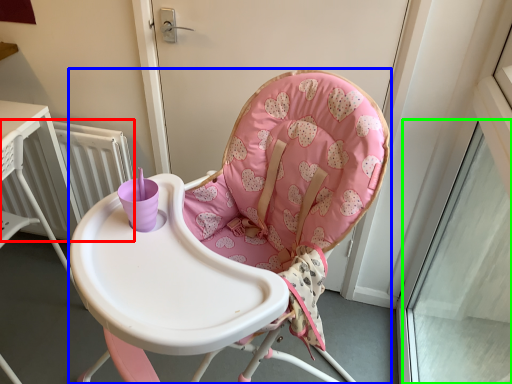
Question: Which object is positioned closest to radiator (highlighted by a red box)? Select from chair (highlighted by a blue box) and window (highlighted by a green box).

Choices:
 (A) chair
 (B) window

Answer: (A)